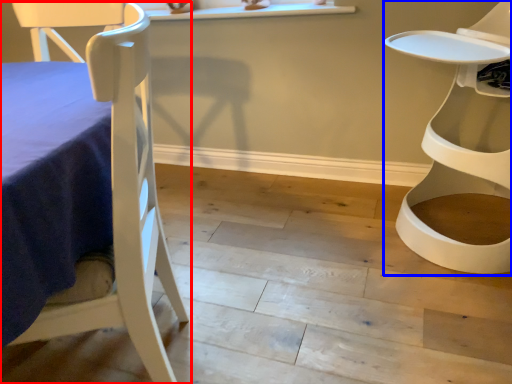
Question: Which point is closer to the camera, chair (highlighted by a red box) or chair (highlighted by a blue box)?

Choices:
 (A) chair
 (B) chair

Answer: (A)